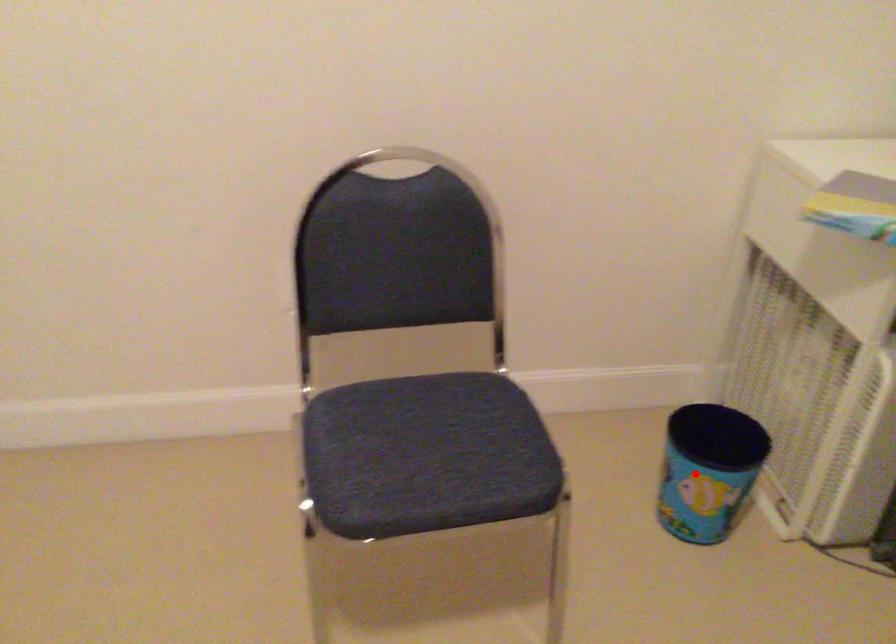
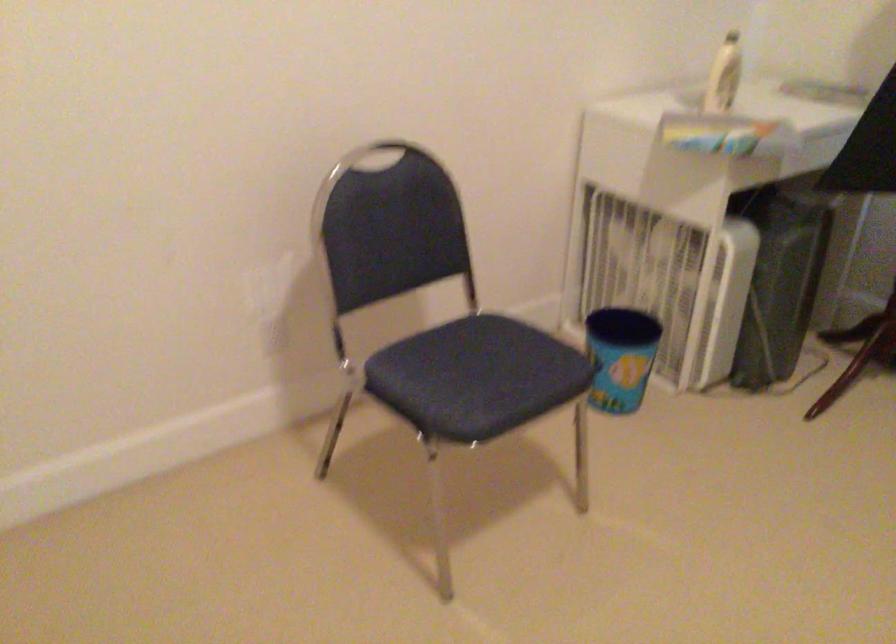
Question: I am providing you with two images of the same scene from different viewpoints. Given a red point in image1, look at the same physical point in image2. Is it:

Choices:
 (A) Closer to the viewpoint
 (B) Farther from the viewpoint

Answer: (B)